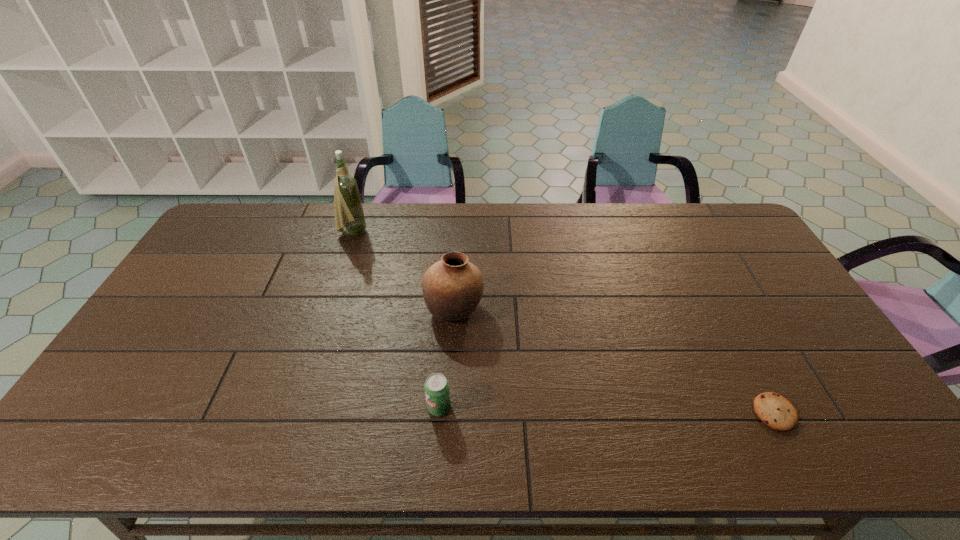
The image size is (960, 540). What are the coordinates of `the leftmost object` in the screenshot? It's located at (348, 209).

Image resolution: width=960 pixels, height=540 pixels. Identify the location of the farthest object. (348, 209).

Locate an element on the screen. the third nearest object is located at coordinates (452, 288).

At what (x,y) coordinates should I click in order to perform the action: click on pottery. Please return your answer as a coordinate pair (x, y). The height and width of the screenshot is (540, 960). Looking at the image, I should click on (452, 288).

Where is `the second shortest object`? the second shortest object is located at coordinates (436, 387).

At what (x,y) coordinates should I click in order to perform the action: click on the rightmost object. Please return your answer as a coordinate pair (x, y). Looking at the image, I should click on (774, 410).

Locate an element on the screen. This screenshot has width=960, height=540. the shortest object is located at coordinates (774, 410).

This screenshot has height=540, width=960. I want to click on vacant region located 0.290m on the front-facing side of the farthest object, so click(x=448, y=232).

I want to click on free spot located on the right of the third nearest object, so click(x=504, y=309).

Locate an element on the screen. vacant space located 0.090m on the front of the second shortest object is located at coordinates (436, 455).